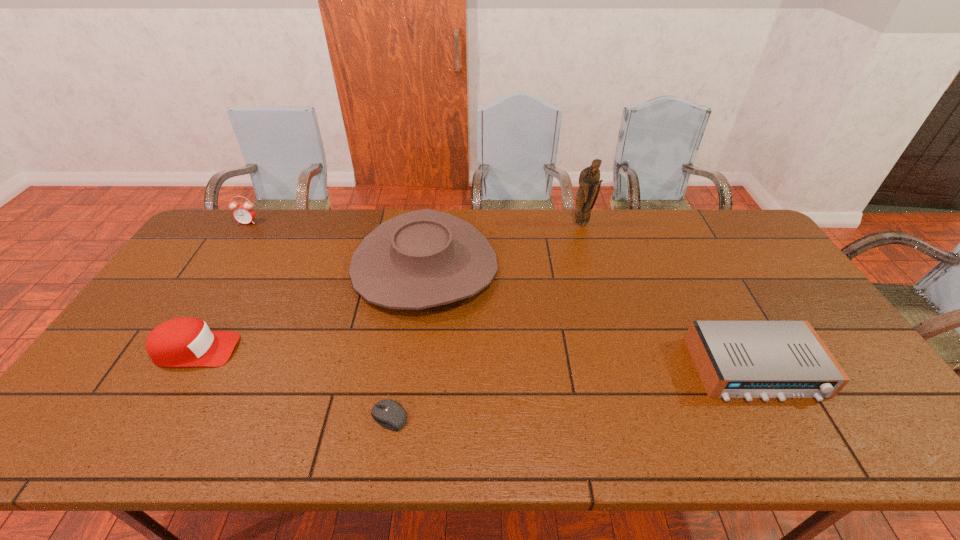
Find the location of a particular element. free space located on the clock face of the alarm clock is located at coordinates (233, 245).

Locate an element on the screen. The image size is (960, 540). free spot located on the front-facing side of the baseball cap is located at coordinates (342, 350).

Find the location of a particular element. vacant region located 0.120m on the control panel of the second shortest object is located at coordinates (802, 453).

Locate an element on the screen. free spot located 0.160m on the left of the computer equipment is located at coordinates (302, 417).

Find the location of a particular element. figurine located at the far edge is located at coordinates (589, 181).

Locate an element on the screen. cowboy hat that is at the far edge is located at coordinates (421, 259).

This screenshot has width=960, height=540. I want to click on alarm clock positioned at the far edge, so click(244, 213).

Identify the location of object that is positioned at the near edge. (389, 414).

This screenshot has width=960, height=540. Find the location of `alarm clock located at the left edge`. alarm clock located at the left edge is located at coordinates (244, 213).

Find the location of `baseball cap located in the left edge section of the desktop`. baseball cap located in the left edge section of the desktop is located at coordinates (181, 342).